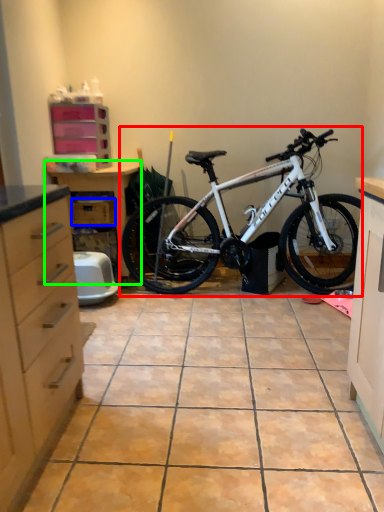
Question: Considering the real-world distances, which object is closest to bicycle (highlighted by a red box)? drawer (highlighted by a blue box) or dresser (highlighted by a green box).

Choices:
 (A) drawer
 (B) dresser

Answer: (B)